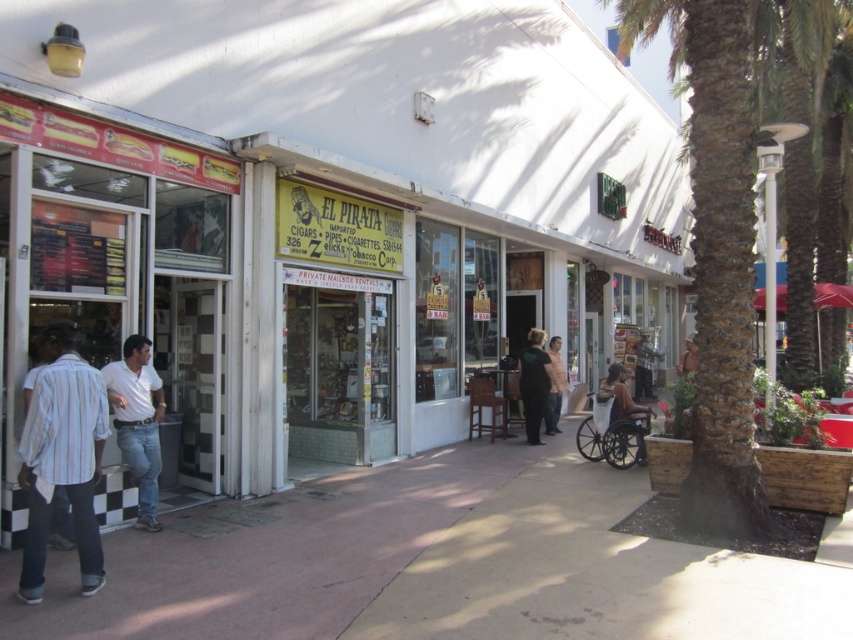
You are a customer looking to buy a shirt. You see a light blue striped shirt at left and a white cotton shirt at center. Which shirt is closer to you?

The light blue striped shirt at left is closer to you since it is in front of the white cotton shirt at center.

You are a fashion designer observing two shirts in a street scene. The scene includes a light blue striped shirt at left and a white cotton shirt at center. Which shirt is bigger in size?

The light blue striped shirt at left is larger in size than the white cotton shirt at center.